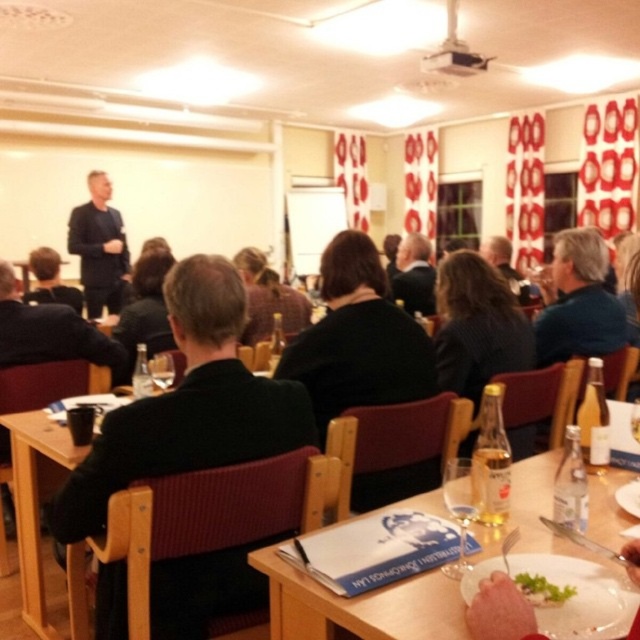
Which is in front, point (236, 282) or point (106, 305)?

Point (236, 282) is more forward.

Is black fabric jacket at center positioned in front of dark blue shirt at center?

That is True.

Between point (211, 604) and point (92, 276), which one is positioned behind?

The point (92, 276) is behind.

At what (x,y) coordinates should I click in order to perform the action: click on black fabric jacket at center. Please return your answer as a coordinate pair (x, y). Looking at the image, I should click on (188, 404).

What do you see at coordinates (188, 404) in the screenshot? I see `black fabric jacket at center` at bounding box center [188, 404].

Looking at this image, is black fabric jacket at center to the left of dark brown leather jacket at left from the viewer's perspective?

Incorrect, black fabric jacket at center is not on the left side of dark brown leather jacket at left.

Identify the location of black fabric jacket at center. This screenshot has width=640, height=640. (188, 404).

Can you confirm if transparent glass at table front is positioned below green leafy salad at lower center?

Actually, transparent glass at table front is above green leafy salad at lower center.

Does point (458, 460) come closer to viewer compared to point (531, 588)?

No, (458, 460) is behind (531, 588).

Does point (464, 477) lie behind point (540, 588)?

Yes, it is behind point (540, 588).

At what (x,y) coordinates should I click in order to perform the action: click on transparent glass at table front. Please return your answer as a coordinate pair (x, y). Looking at the image, I should click on (460, 506).